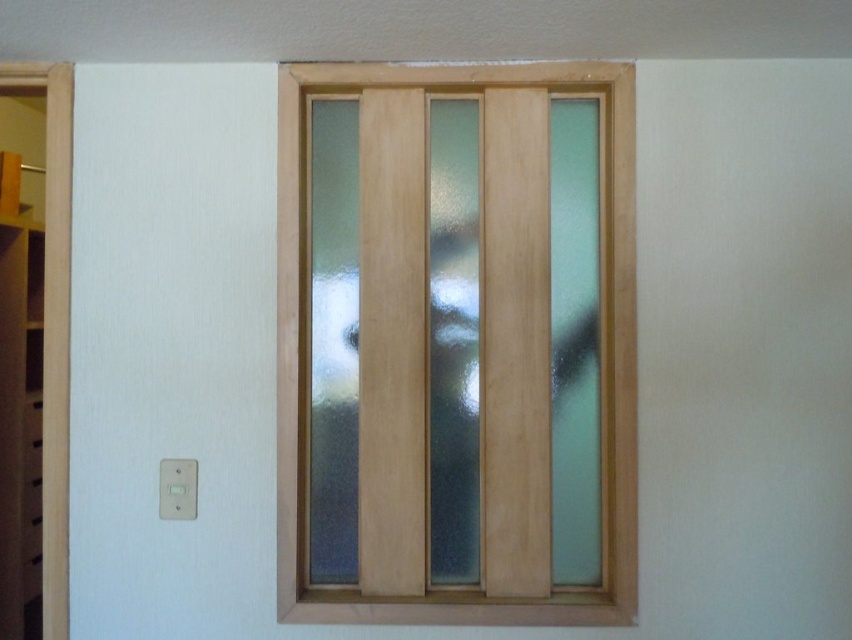
Question: Among these objects, which one is nearest to the camera?

Choices:
 (A) frosted glass door at center
 (B) white wood door at left

Answer: (A)

Question: Does frosted glass door at center appear on the left side of white wood door at left?

Choices:
 (A) no
 (B) yes

Answer: (A)

Question: Does frosted glass door at center have a greater width compared to white wood door at left?

Choices:
 (A) no
 (B) yes

Answer: (B)

Question: Which point appears closest to the camera in this image?

Choices:
 (A) (635, 557)
 (B) (61, 232)

Answer: (A)

Question: Is frosted glass door at center positioned behind white wood door at left?

Choices:
 (A) yes
 (B) no

Answer: (B)